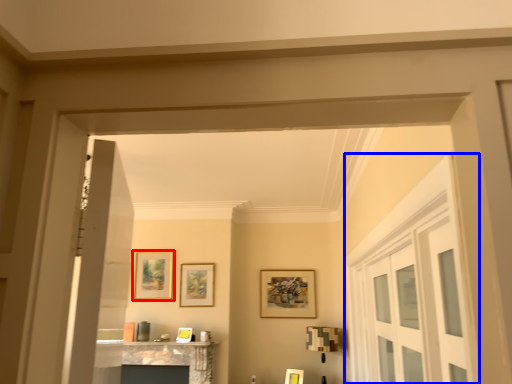
Question: Which of the following is the farthest to the observer, picture frame (highlighted by a red box) or door (highlighted by a blue box)?

Choices:
 (A) picture frame
 (B) door

Answer: (A)